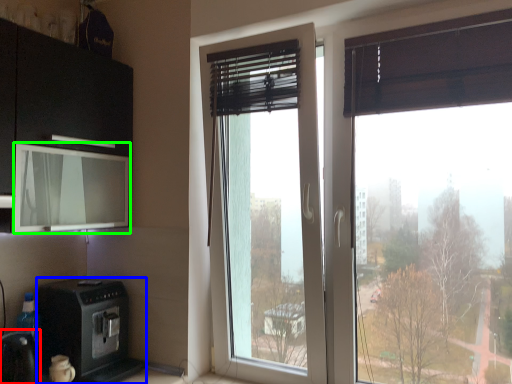
Question: Considering the real-world distances, which object is closest to appliance (highlighted by a red box)? home appliance (highlighted by a blue box) or window screen (highlighted by a green box).

Choices:
 (A) home appliance
 (B) window screen

Answer: (A)